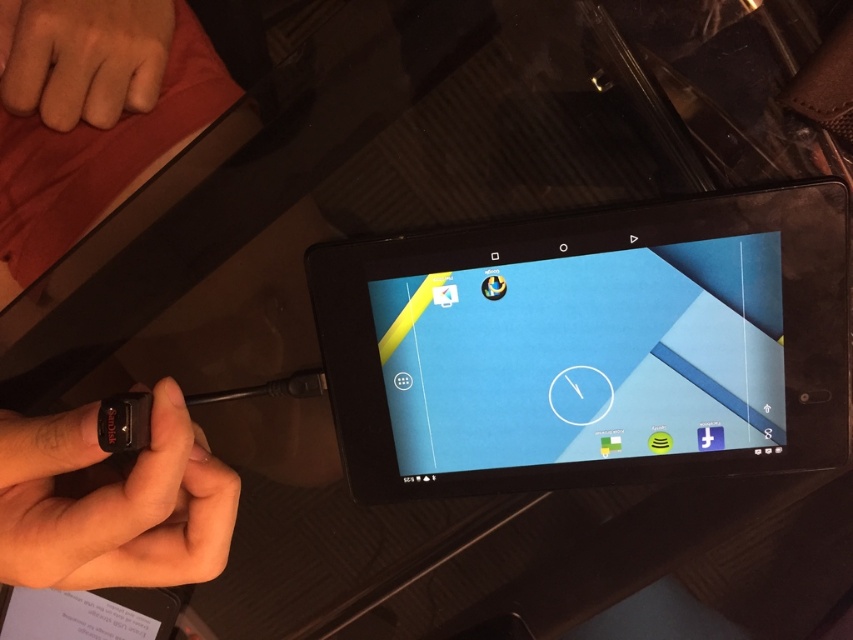
Question: Which object appears farthest from the camera in this image?

Choices:
 (A) black matte usb cable at lower left
 (B) black plastic tablet at center
 (C) skinny flesh at upper left

Answer: (C)

Question: Does black matte usb cable at lower left appear on the right side of skinny flesh at upper left?

Choices:
 (A) no
 (B) yes

Answer: (B)

Question: Among these objects, which one is farthest from the camera?

Choices:
 (A) black matte usb cable at lower left
 (B) black plastic tablet at center
 (C) skinny flesh at upper left

Answer: (C)

Question: Considering the real-world distances, which object is farthest from the skinny flesh at upper left?

Choices:
 (A) black plastic tablet at center
 (B) black matte usb cable at lower left

Answer: (A)

Question: Can you confirm if black plastic tablet at center is positioned to the right of black matte usb cable at lower left?

Choices:
 (A) yes
 (B) no

Answer: (A)

Question: Where is black plastic tablet at center located in relation to skinny flesh at upper left in the image?

Choices:
 (A) above
 (B) below

Answer: (B)